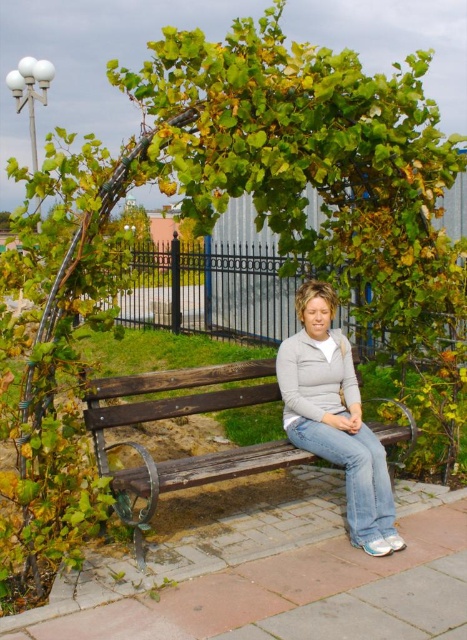
Question: Can you confirm if wooden bench at center is positioned to the left of light gray fleece sweater at center?

Choices:
 (A) yes
 (B) no

Answer: (A)

Question: Which of the following is the farthest from the observer?

Choices:
 (A) light gray fleece sweater at center
 (B) wooden bench at center

Answer: (A)

Question: Which object is farther from the camera taking this photo?

Choices:
 (A) wooden bench at center
 (B) light gray fleece sweater at center

Answer: (B)

Question: Does wooden bench at center appear over light gray fleece sweater at center?

Choices:
 (A) no
 (B) yes

Answer: (A)

Question: Is wooden bench at center positioned at the back of light gray fleece sweater at center?

Choices:
 (A) yes
 (B) no

Answer: (B)